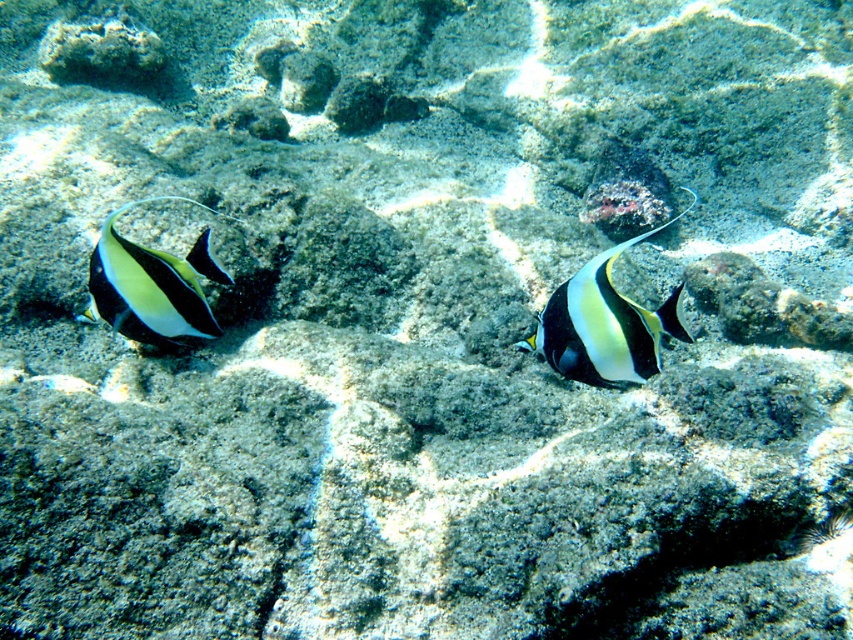
Between black glossy fish at center and shiny silver fish at left, which one appears on the left side from the viewer's perspective?

Answer: From the viewer's perspective, shiny silver fish at left appears more on the left side.

The width and height of the screenshot is (853, 640). I want to click on black glossy fish at center, so click(604, 324).